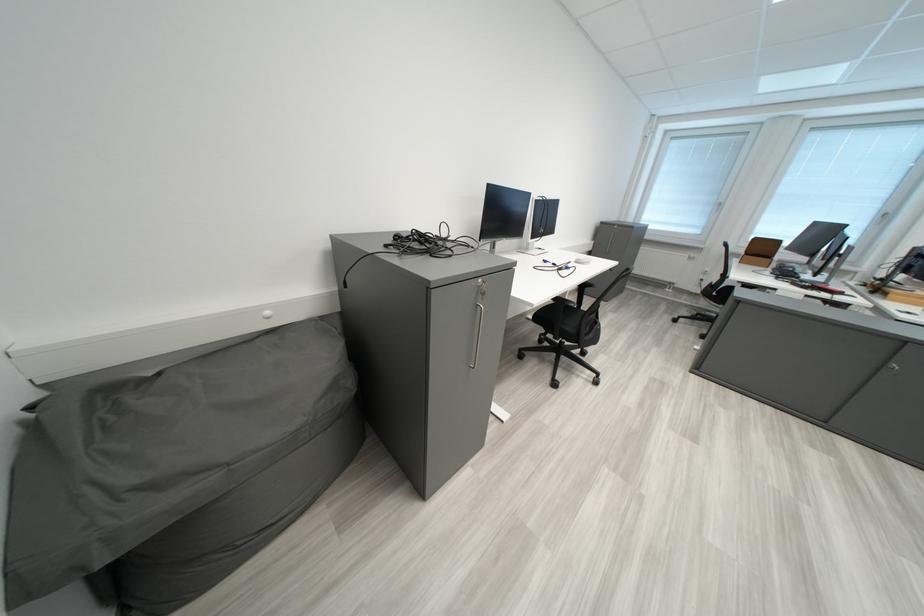
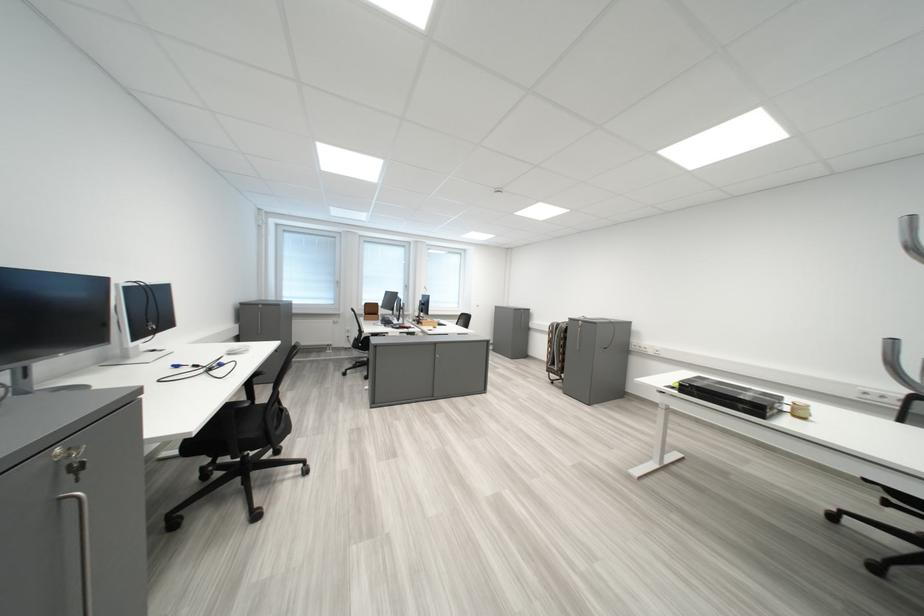
Question: Based on the continuous images, in which direction is the camera rotating? Reply with the corresponding letter.

Choices:
 (A) Left
 (B) Right
 (C) Up
 (D) Down

Answer: (B)